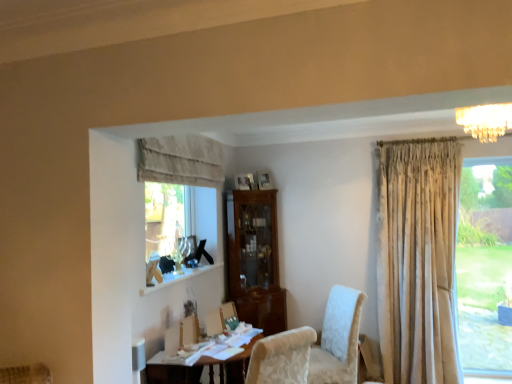
Question: Considering the relative positions of crystal chandelier at upper right and wooden table at lower center in the image provided, is crystal chandelier at upper right to the left or to the right of wooden table at lower center?

Choices:
 (A) left
 (B) right

Answer: (B)

Question: From a real-world perspective, is crystal chandelier at upper right positioned above or below wooden table at lower center?

Choices:
 (A) below
 (B) above

Answer: (B)

Question: Based on their relative distances, which object is farther from the crystal chandelier at upper right?

Choices:
 (A) white textured chair at center
 (B) wooden table at lower center
 (C) neutral fabric curtain at upper center

Answer: (B)

Question: Estimate the real-world distances between objects in this image. Which object is closer to the white textured chair at center?

Choices:
 (A) neutral fabric curtain at upper center
 (B) crystal chandelier at upper right
 (C) wooden table at lower center

Answer: (C)